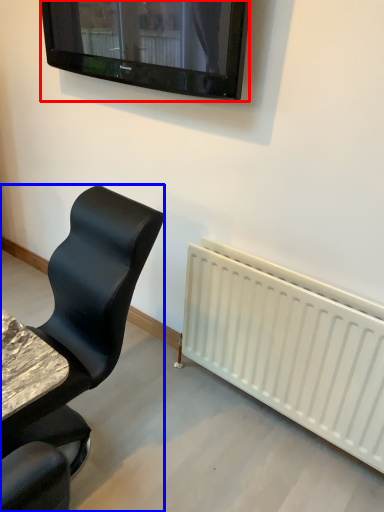
Question: Which point is closer to the camera, television (highlighted by a red box) or chair (highlighted by a blue box)?

Choices:
 (A) television
 (B) chair

Answer: (B)